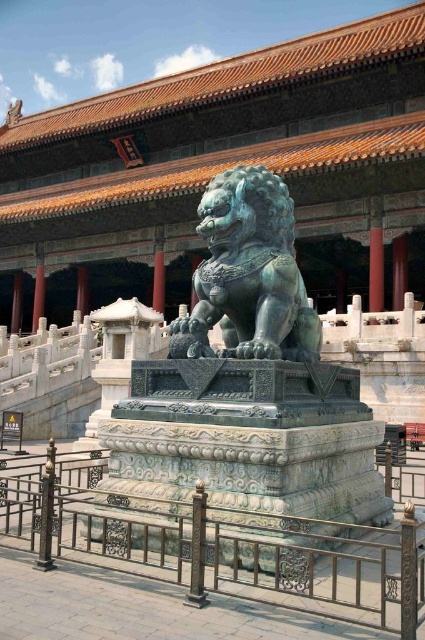
Question: Does metallic gold railing at lower center come in front of green polished stone lion at center?

Choices:
 (A) yes
 (B) no

Answer: (A)

Question: Which point is closer to the camera?

Choices:
 (A) (232, 300)
 (B) (302, 602)

Answer: (B)

Question: Is metallic gold railing at lower center positioned at the back of green polished stone lion at center?

Choices:
 (A) yes
 (B) no

Answer: (B)

Question: Can you confirm if metallic gold railing at lower center is smaller than green polished stone lion at center?

Choices:
 (A) no
 (B) yes

Answer: (A)

Question: Which of the following is the closest to the observer?

Choices:
 (A) (257, 312)
 (B) (51, 477)

Answer: (B)